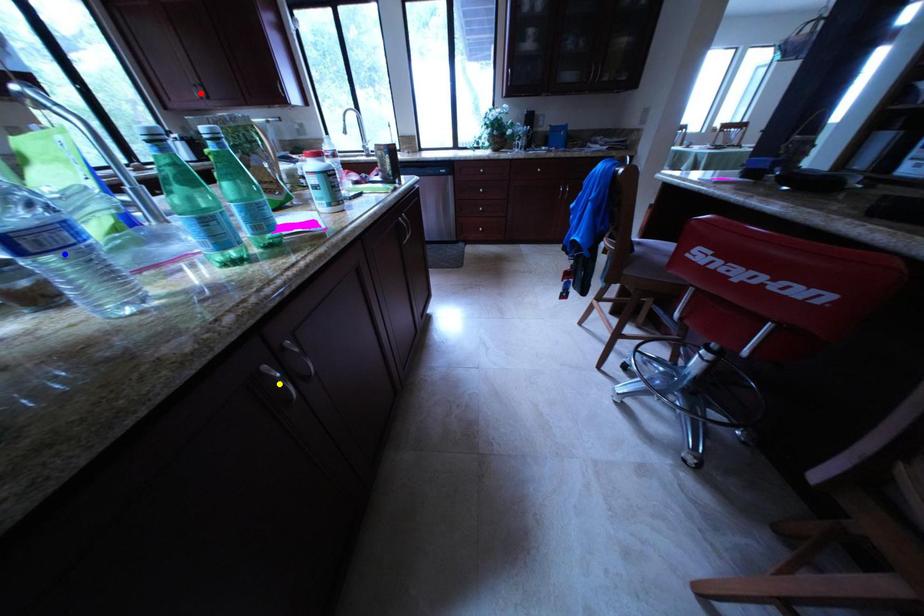
Order these from nearest to farthest:
blue point | red point | yellow point

blue point < yellow point < red point